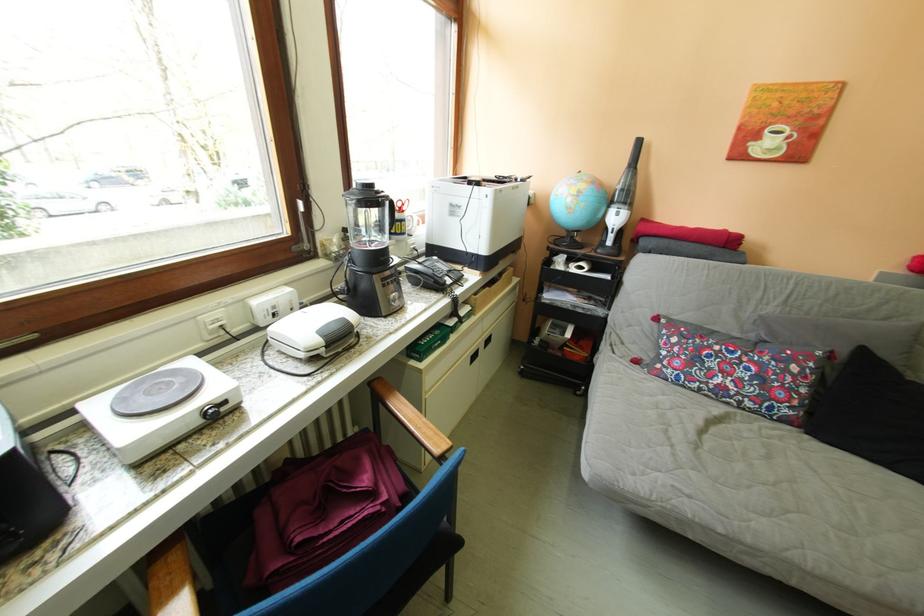
Describe the element at coordinates (792, 475) in the screenshot. I see `a sofa sitting surface` at that location.